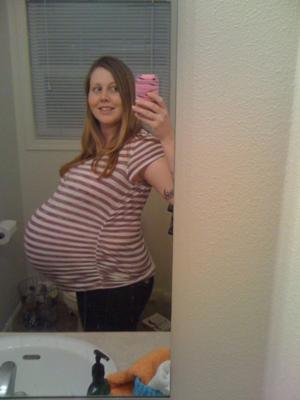
At what (x,y) coordinates should I click in order to perform the action: click on toilet paper roll. Please return your answer as a coordinate pair (x, y). The height and width of the screenshot is (400, 300). Looking at the image, I should click on (9, 229).